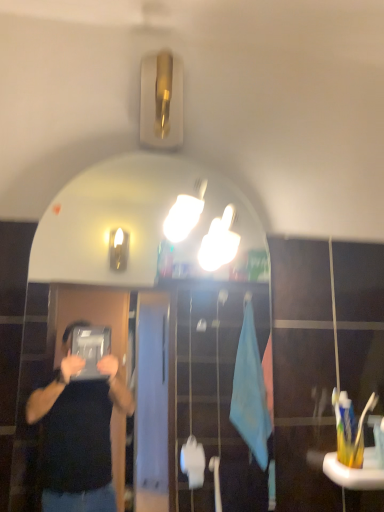
Question: From a real-world perspective, does yellow plastic toothbrush at lower right, the third toothbrush from the left, sit lower than white plastic toothbrush at right, the 3th toothbrush from the right?

Choices:
 (A) yes
 (B) no

Answer: (A)

Question: Can you confirm if yellow plastic toothbrush at lower right, the third toothbrush from the left, is shorter than white plastic toothbrush at right, which is counted as the 1th toothbrush, starting from the left?

Choices:
 (A) yes
 (B) no

Answer: (A)

Question: Considering the relative sizes of yellow plastic toothbrush at lower right, the first toothbrush viewed from the right, and white plastic toothbrush at right, which is counted as the 1th toothbrush, starting from the left, in the image provided, is yellow plastic toothbrush at lower right, the first toothbrush viewed from the right, smaller than white plastic toothbrush at right, which is counted as the 1th toothbrush, starting from the left,?

Choices:
 (A) yes
 (B) no

Answer: (B)

Question: Is yellow plastic toothbrush at lower right, the first toothbrush viewed from the right, positioned with its back to white plastic toothbrush at right, the 3th toothbrush from the right?

Choices:
 (A) no
 (B) yes

Answer: (A)

Question: Is yellow plastic toothbrush at lower right, the first toothbrush viewed from the right, far from white plastic toothbrush at right, the 3th toothbrush from the right?

Choices:
 (A) no
 (B) yes

Answer: (A)

Question: Is yellow plastic toothbrush at lower right, the third toothbrush from the left, next to white plastic toothbrush at right, which is counted as the 1th toothbrush, starting from the left?

Choices:
 (A) no
 (B) yes

Answer: (B)

Question: Does white plastic toothbrush at right, the 3th toothbrush from the right, come in front of white glossy mirror at upper center?

Choices:
 (A) no
 (B) yes

Answer: (A)

Question: Does white plastic toothbrush at right, the 3th toothbrush from the right, have a larger size compared to white glossy mirror at upper center?

Choices:
 (A) yes
 (B) no

Answer: (B)

Question: Does white plastic toothbrush at right, the 3th toothbrush from the right, have a smaller size compared to white glossy mirror at upper center?

Choices:
 (A) yes
 (B) no

Answer: (A)

Question: Can you confirm if white plastic toothbrush at right, which is counted as the 1th toothbrush, starting from the left, is wider than white glossy mirror at upper center?

Choices:
 (A) yes
 (B) no

Answer: (B)

Question: Is white plastic toothbrush at right, the 3th toothbrush from the right, to the right of white glossy mirror at upper center from the viewer's perspective?

Choices:
 (A) no
 (B) yes

Answer: (B)

Question: Does white plastic toothbrush at right, the 3th toothbrush from the right, have a lesser width compared to white glossy mirror at upper center?

Choices:
 (A) no
 (B) yes

Answer: (B)

Question: Can you confirm if yellow plastic toothbrush at lower right, the third toothbrush from the left, is thinner than white glossy mirror at upper center?

Choices:
 (A) yes
 (B) no

Answer: (B)